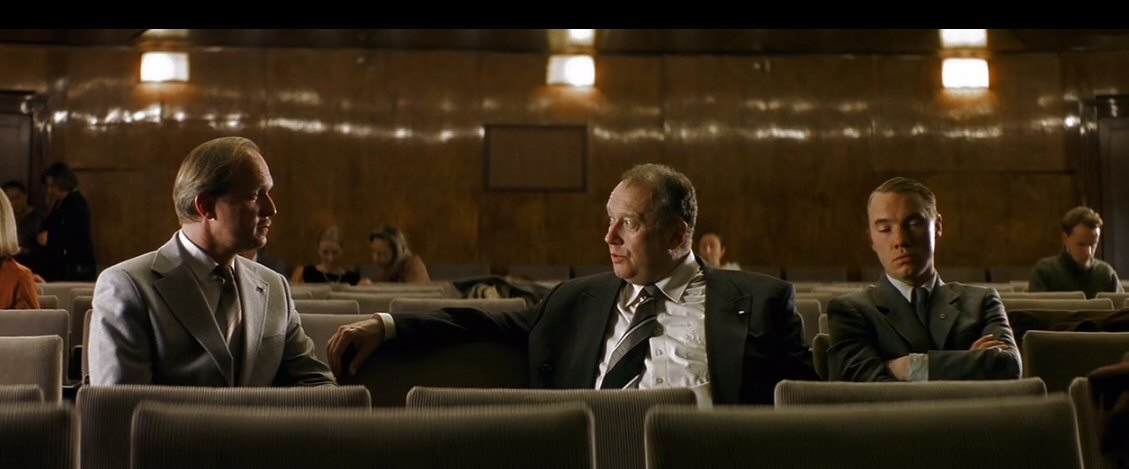
Identify the location of lights. This screenshot has width=1129, height=469. (156, 71), (572, 72), (963, 74).